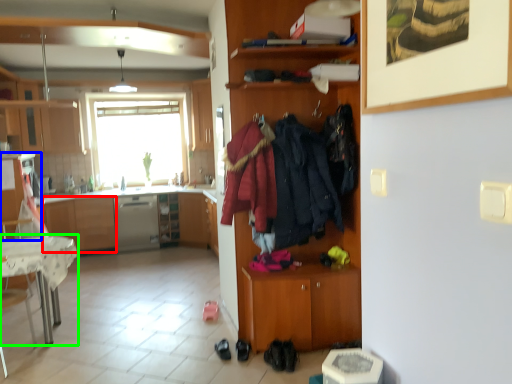
Question: Which is nearer to the cabinetry (highlighted by a red box)? cabinetry (highlighted by a blue box) or desk (highlighted by a green box).

Choices:
 (A) cabinetry
 (B) desk

Answer: (A)